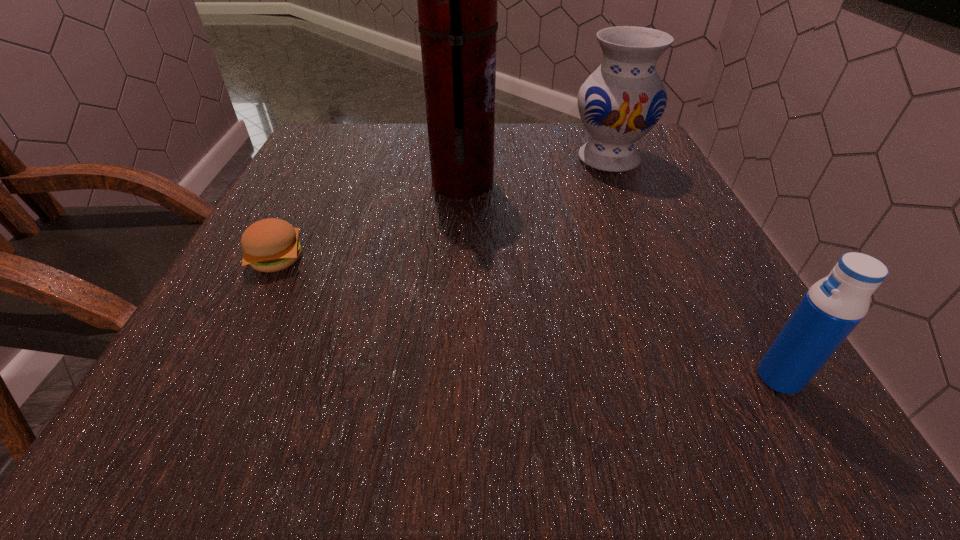
Find the location of a particular element. The height and width of the screenshot is (540, 960). empty location between the fire extinguisher and the hamburger is located at coordinates [x=370, y=221].

Identify the location of vacant region between the tallest object and the leftmost object. (370, 221).

What are the coordinates of `vacant space in between the third shortest object and the second object from left to right` in the screenshot? It's located at (536, 171).

Locate an element on the screen. Image resolution: width=960 pixels, height=540 pixels. free point between the water bottle and the hamburger is located at coordinates (528, 318).

You are a GUI agent. You are given a task and a screenshot of the screen. Output one action in this format:
    pyautogui.click(x=<x>, y=<y>)
    Task: Click on the free space between the third shortest object and the shortest object
    The image size is (960, 540).
    Given the screenshot: What is the action you would take?
    pyautogui.click(x=443, y=209)

Where is `empty space that is in between the second nearest object and the nearest object`? The height and width of the screenshot is (540, 960). empty space that is in between the second nearest object and the nearest object is located at coordinates (528, 318).

Where is `object that is the third closest to the fire extinguisher`? This screenshot has width=960, height=540. object that is the third closest to the fire extinguisher is located at coordinates (833, 306).

Locate an element on the screen. The height and width of the screenshot is (540, 960). object that is the second closest one to the third farthest object is located at coordinates (622, 100).

Locate an element on the screen. The image size is (960, 540). free location that satisfies the following two spatial constraints: 1. on the side of the tallest object with the handle and hose; 2. on the right side of the third tallest object is located at coordinates (452, 377).

Where is `vacant space that satisfies the following two spatial constraints: 1. on the back side of the vase; 2. on the right side of the second nearest object`? vacant space that satisfies the following two spatial constraints: 1. on the back side of the vase; 2. on the right side of the second nearest object is located at coordinates (328, 159).